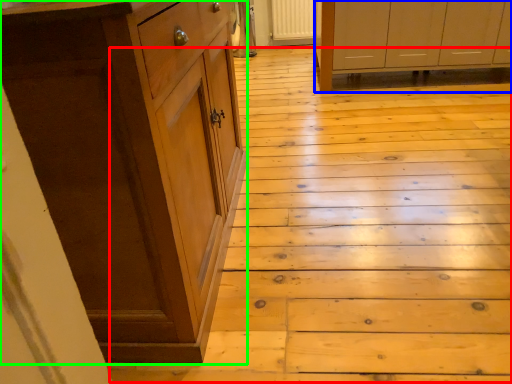
Question: Based on their relative distances, which object is farther from stair (highlighted by a red box)? Choose from cabinetry (highlighted by a blue box) and cabinetry (highlighted by a green box).

Choices:
 (A) cabinetry
 (B) cabinetry

Answer: (A)